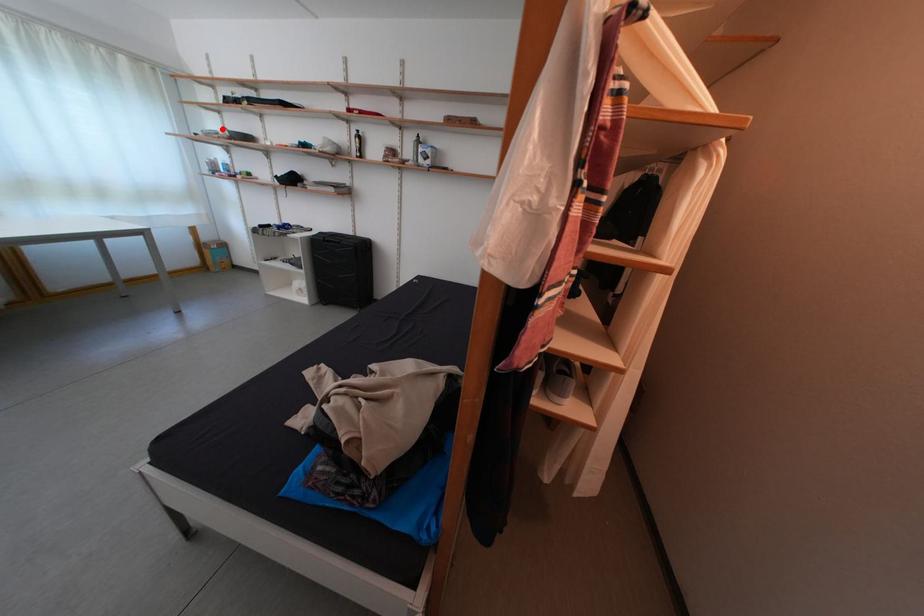
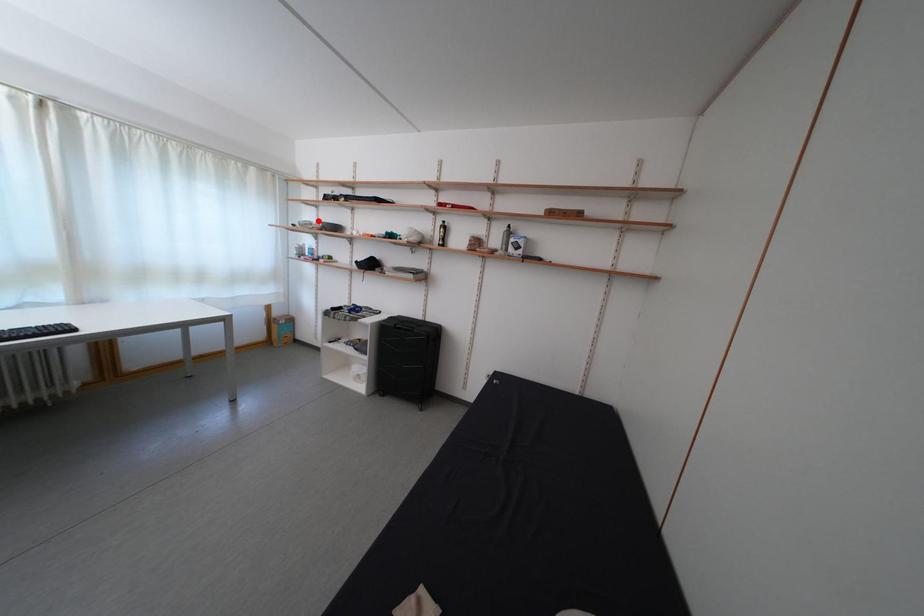
I am providing you with two images of the same scene from different viewpoints. A red point is marked on the first image and another point is marked on the second image. Is the marked point in image1 the same physical position as the marked point in image2?

Yes